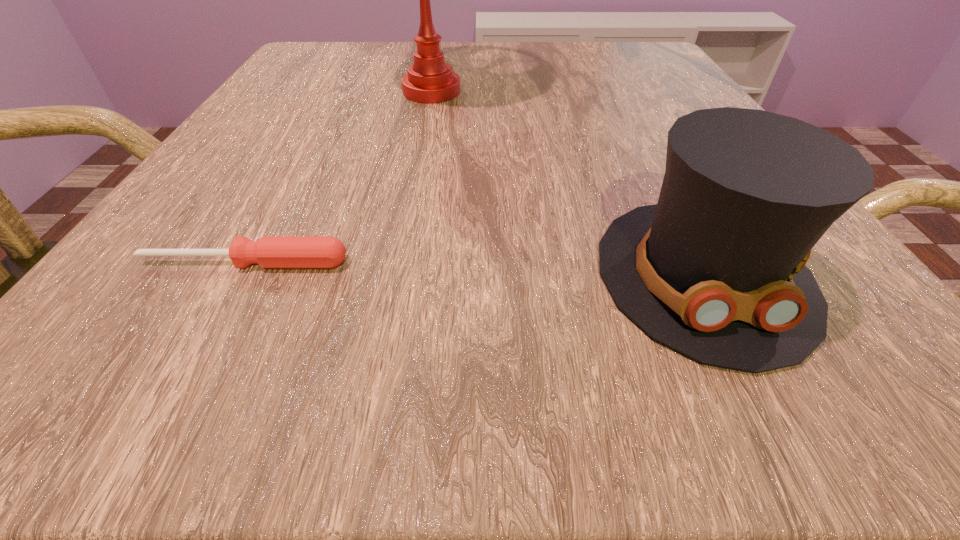
What are the coordinates of `free point between the table lamp and the dress hat` in the screenshot? It's located at (567, 184).

Where is `free space between the screwdriver and the tallest object`? The width and height of the screenshot is (960, 540). free space between the screwdriver and the tallest object is located at coordinates (338, 178).

The image size is (960, 540). Identify the location of vacant space in between the tallest object and the screwdriver. (338, 178).

Find the location of a particular element. This screenshot has height=540, width=960. unoccupied position between the second shortest object and the shortest object is located at coordinates (474, 269).

Find the location of a particular element. empty space between the farthest object and the second tallest object is located at coordinates (567, 184).

Identify the location of vacant space that's between the table lamp and the screwdriver. coord(338,178).

This screenshot has width=960, height=540. I want to click on vacant space that's between the farthest object and the dress hat, so click(567, 184).

The image size is (960, 540). I want to click on vacant area that lies between the screwdriver and the rightmost object, so click(x=474, y=269).

Locate an element on the screen. This screenshot has width=960, height=540. free spot between the shortest object and the dress hat is located at coordinates (474, 269).

At what (x,y) coordinates should I click in order to perform the action: click on vacant area that lies between the screwdriver and the tallest object. Please return your answer as a coordinate pair (x, y). Looking at the image, I should click on (338, 178).